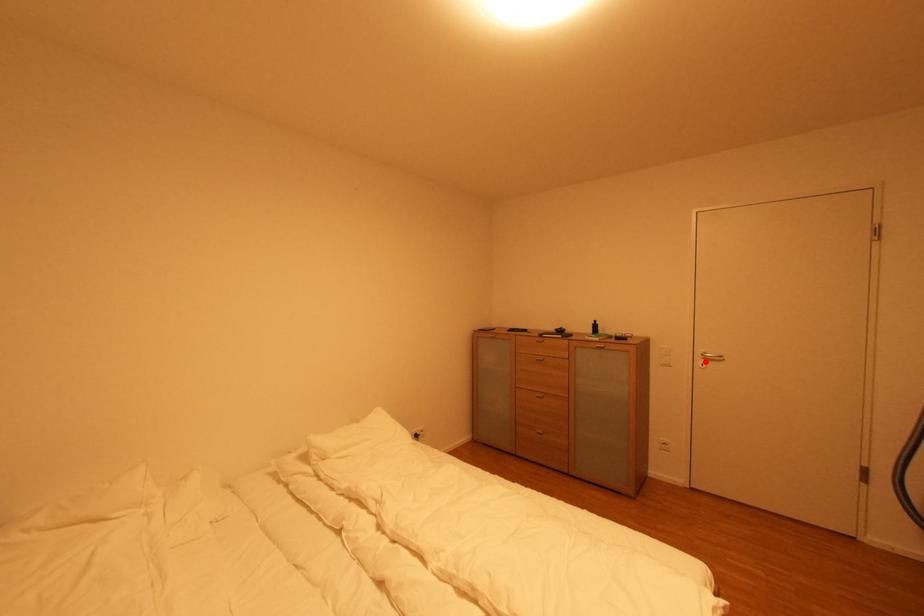
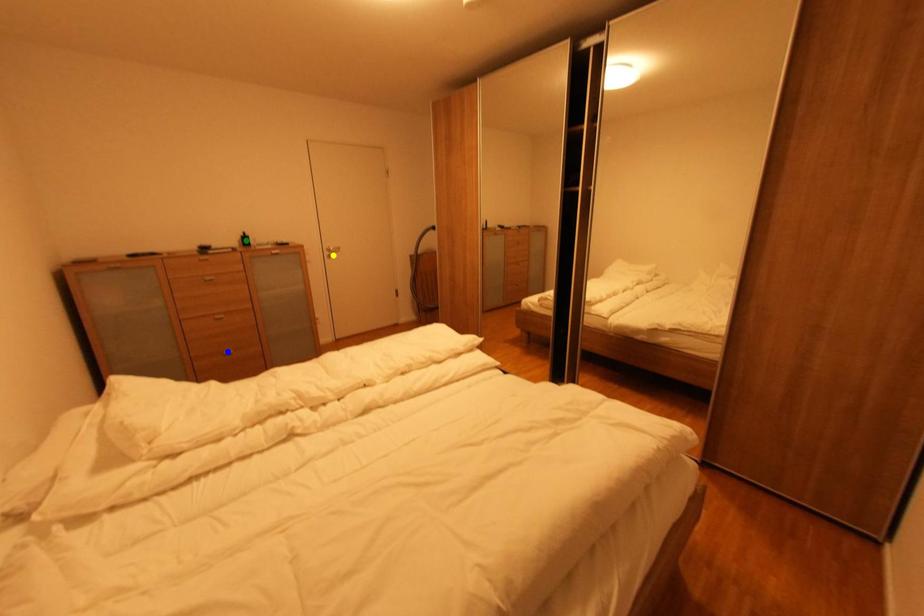
Question: I am providing you with two images of the same scene from different viewpoints. A red point is marked on the first image. You are given multiple points on the second image. In image 2, which mark is for the same physical point as the one in image 1?

Choices:
 (A) green point
 (B) blue point
 (C) yellow point

Answer: (C)